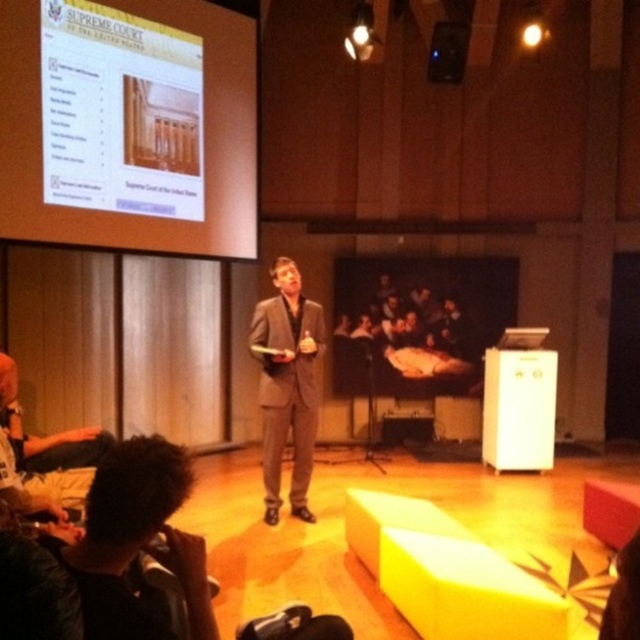
Can you confirm if white glossy projection screen at upper left is smaller than matte gray suit at center?

No, white glossy projection screen at upper left is not smaller than matte gray suit at center.

Can you confirm if white glossy projection screen at upper left is positioned above matte gray suit at center?

Correct, white glossy projection screen at upper left is located above matte gray suit at center.

Which is in front, point (198, 179) or point (292, 484)?

Positioned in front is point (292, 484).

You are a GUI agent. You are given a task and a screenshot of the screen. Output one action in this format:
    pyautogui.click(x=<x>, y=<y>)
    Task: Click on the white glossy projection screen at upper left
    
    Given the screenshot: What is the action you would take?
    click(x=129, y=124)